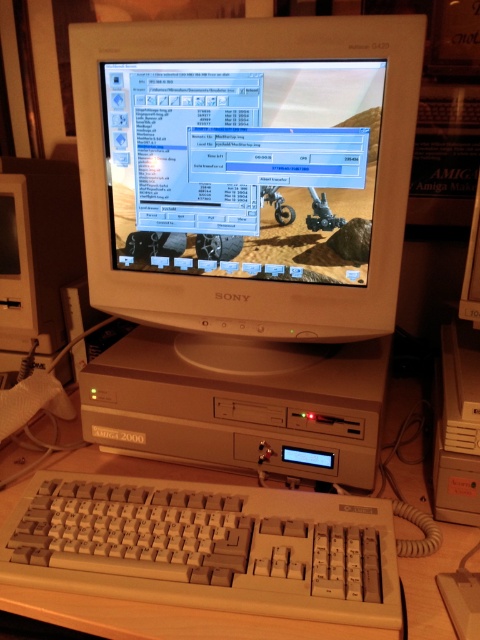
Question: Does white plastic monitor at center appear on the right side of white plastic keyboard at lower center?

Choices:
 (A) yes
 (B) no

Answer: (A)

Question: Which of the following is the closest to the observer?

Choices:
 (A) white plastic monitor at center
 (B) white plastic keyboard at lower center

Answer: (B)

Question: Is white plastic monitor at center further to camera compared to white plastic keyboard at lower center?

Choices:
 (A) no
 (B) yes

Answer: (B)

Question: Does white plastic monitor at center appear on the left side of white plastic keyboard at lower center?

Choices:
 (A) no
 (B) yes

Answer: (A)

Question: Which of the following is the farthest from the observer?

Choices:
 (A) (367, 179)
 (B) (129, 513)

Answer: (A)